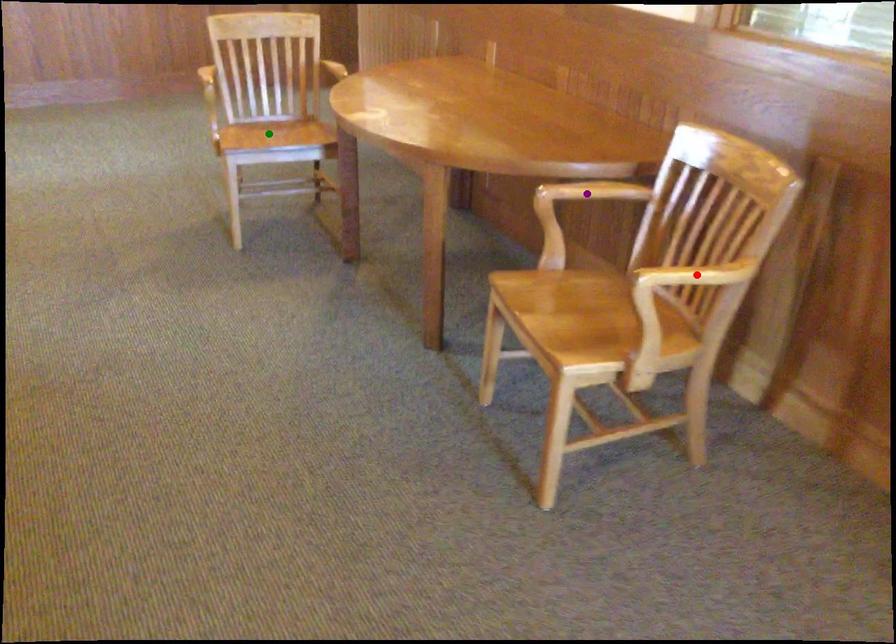
Order these from nearest to farthest:
red point | purple point | green point

red point, purple point, green point